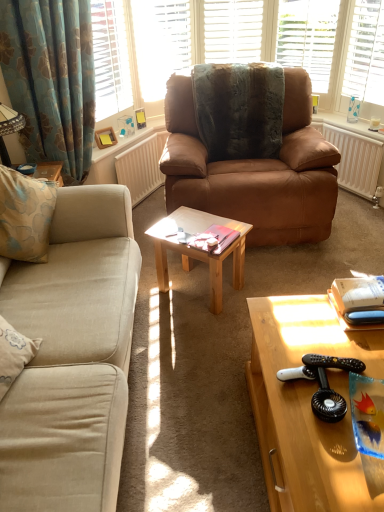
Question: Is the position of matte wooden picture frame at upper left more distant than that of white textured radiator at right, which appears as the first radiator when viewed from the right?

Choices:
 (A) no
 (B) yes

Answer: (B)

Question: Is matte wooden picture frame at upper left at the left side of white textured radiator at right, which appears as the first radiator when viewed from the right?

Choices:
 (A) no
 (B) yes

Answer: (B)

Question: From the image's perspective, is matte wooden picture frame at upper left under white textured radiator at right, which appears as the first radiator when viewed from the right?

Choices:
 (A) no
 (B) yes

Answer: (A)

Question: Is matte wooden picture frame at upper left positioned with its back to white textured radiator at right, marked as the 2th radiator in a left-to-right arrangement?

Choices:
 (A) no
 (B) yes

Answer: (A)

Question: Is matte wooden picture frame at upper left positioned in front of white textured radiator at right, marked as the 2th radiator in a left-to-right arrangement?

Choices:
 (A) no
 (B) yes

Answer: (A)

Question: In the image, is wooden coffee table at lower right, which is counted as the 1th coffee table, starting from the right, on the left side or the right side of light brown wooden table at center, which ranks as the 1th coffee table in left-to-right order?

Choices:
 (A) right
 (B) left

Answer: (A)

Question: Is wooden coffee table at lower right, which is counted as the 1th coffee table, starting from the right, bigger or smaller than light brown wooden table at center, which is the 2th coffee table from front to back?

Choices:
 (A) big
 (B) small

Answer: (A)

Question: Does point (311, 388) appear closer or farther from the camera than point (160, 283)?

Choices:
 (A) closer
 (B) farther

Answer: (A)

Question: Choose the correct answer: Is wooden coffee table at lower right, which is counted as the 1th coffee table, starting from the right, inside light brown wooden table at center, the second coffee table when ordered from bottom to top, or outside it?

Choices:
 (A) outside
 (B) inside

Answer: (A)

Question: Considering their positions, is blue floral fabric curtain at left located in front of or behind white matte shutter at upper center?

Choices:
 (A) front
 (B) behind

Answer: (A)

Question: From the image's perspective, is blue floral fabric curtain at left above or below white matte shutter at upper center?

Choices:
 (A) below
 (B) above

Answer: (A)

Question: From a real-world perspective, is blue floral fabric curtain at left physically located above or below white matte shutter at upper center?

Choices:
 (A) below
 (B) above

Answer: (A)

Question: Considering the relative positions of blue floral fabric curtain at left and white matte shutter at upper center in the image provided, is blue floral fabric curtain at left to the left or to the right of white matte shutter at upper center?

Choices:
 (A) right
 (B) left

Answer: (B)

Question: Is clear glass vase at upper right, the 1th window in the right-to-left sequence, in front of or behind blue floral fabric curtain at left in the image?

Choices:
 (A) behind
 (B) front

Answer: (A)

Question: Looking at the image, does clear glass vase at upper right, acting as the third window starting from the left, seem bigger or smaller compared to blue floral fabric curtain at left?

Choices:
 (A) big
 (B) small

Answer: (B)